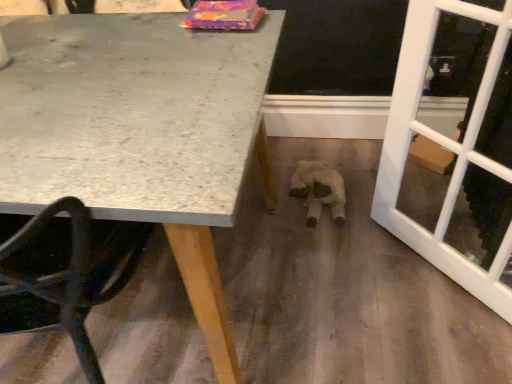
Identify the location of free spot in front of white glass screen door at right. (444, 326).